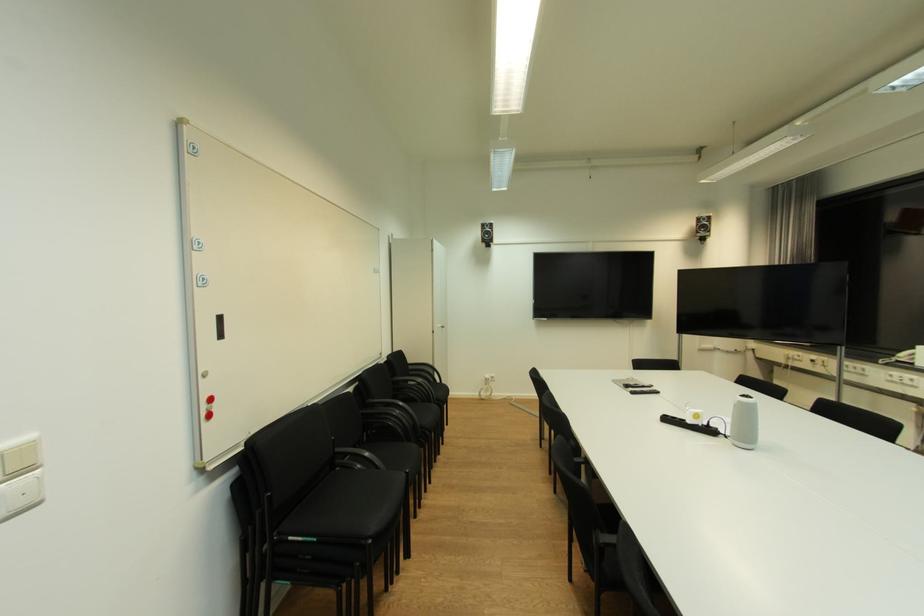
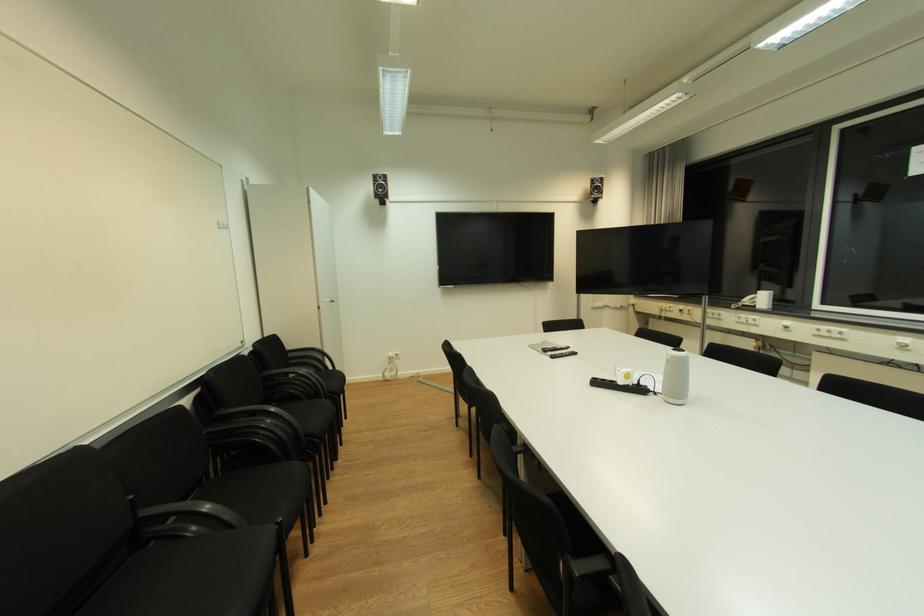
Where in the second image is the point corresponding to point (696, 423) from the first image?

(626, 384)